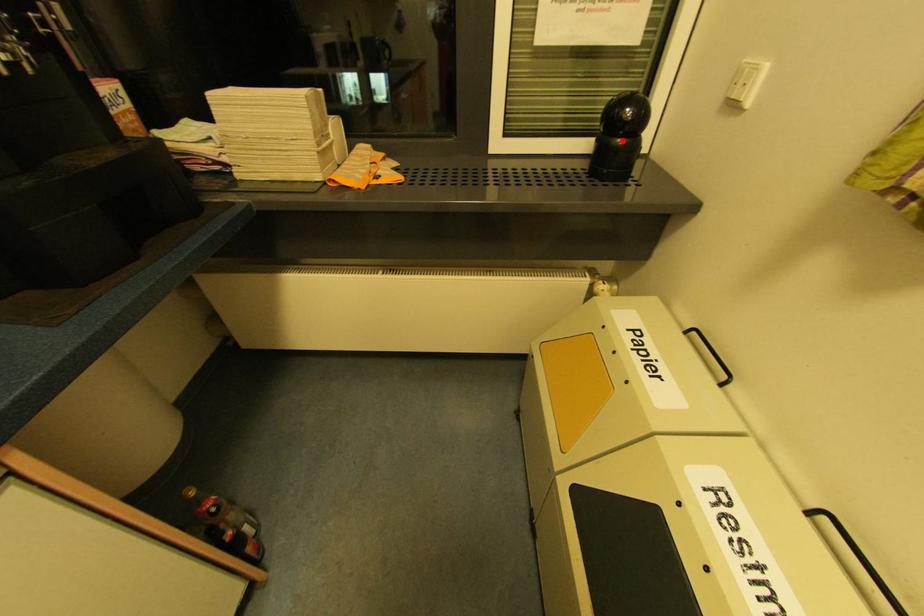
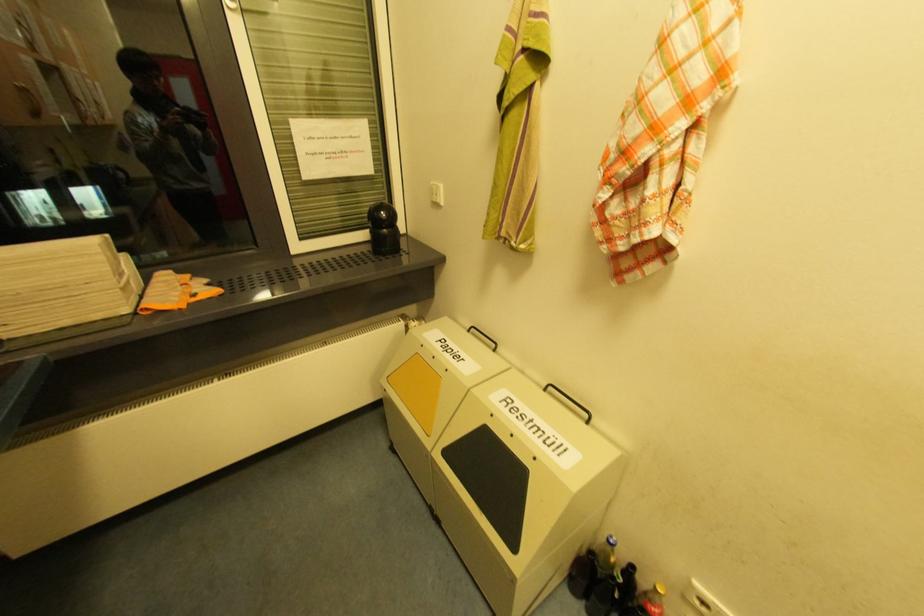
Locate, in the second image, the point that corresponds to the highlighted location in the first image.

(388, 230)